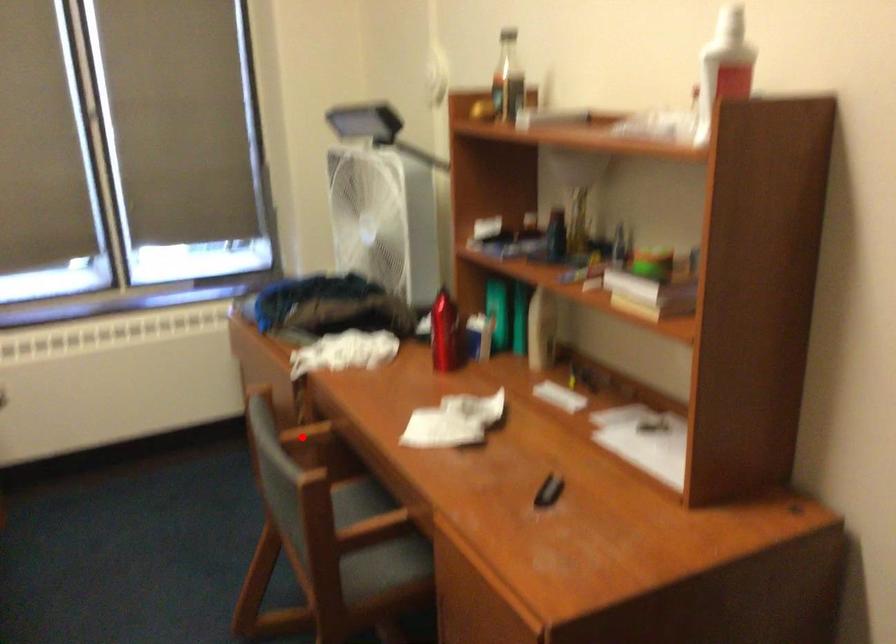
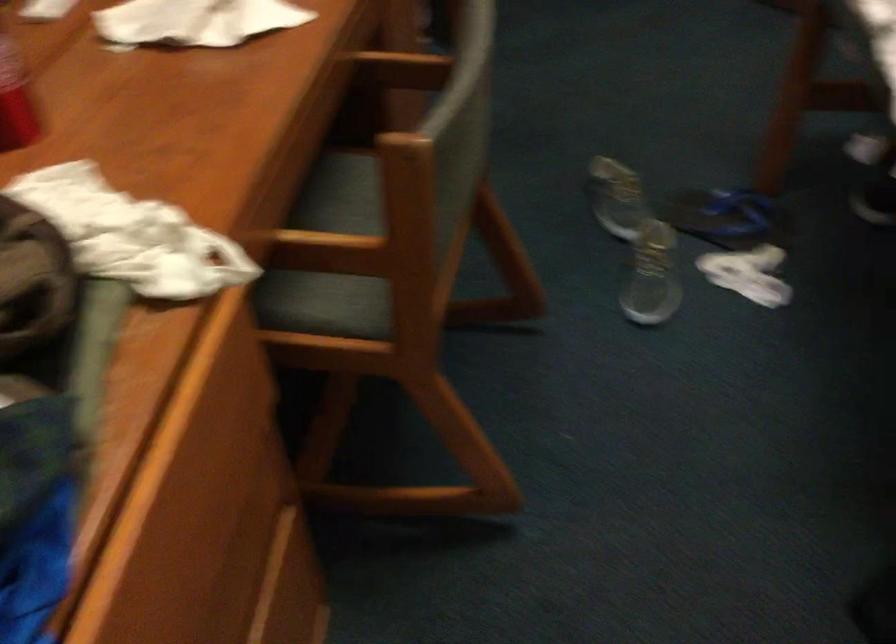
Question: A red point is marked in image1. In image2, is the corresponding 3D point closer to the camera or farther? Reply with the corresponding letter.

Choices:
 (A) The corresponding 3D point is closer.
 (B) The corresponding 3D point is farther.

Answer: (A)